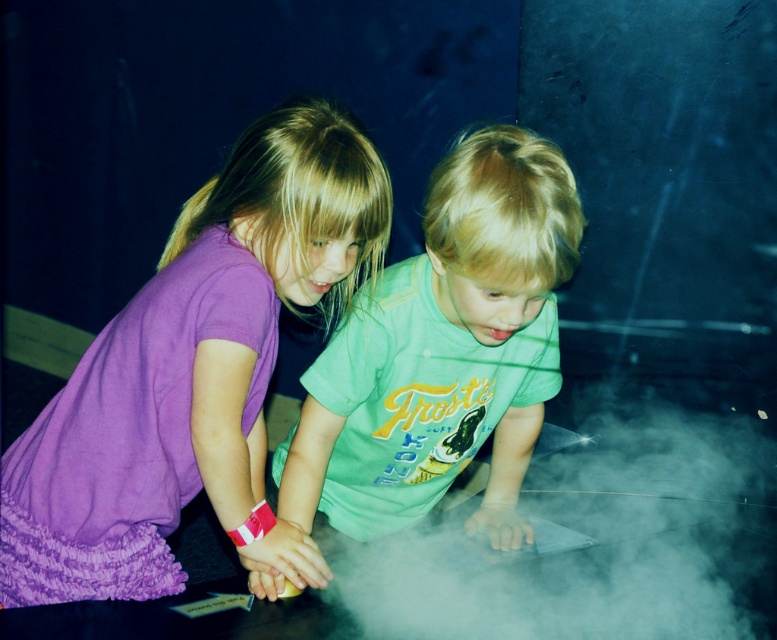
Question: Which point appears closest to the camera in this image?

Choices:
 (A) (531, 362)
 (B) (619, 608)

Answer: (B)

Question: Does purple fabric dress at left appear under green matte shirt at center?

Choices:
 (A) yes
 (B) no

Answer: (A)

Question: Which point is closer to the camera taking this photo?

Choices:
 (A) (420, 404)
 (B) (152, 500)
 (C) (610, 481)

Answer: (B)

Question: Can you confirm if purple fabric dress at left is thinner than green matte shirt at center?

Choices:
 (A) yes
 (B) no

Answer: (B)

Question: Estimate the real-world distances between objects in this image. Which object is farther from the purple fabric dress at left?

Choices:
 (A) white fog at center
 (B) green matte shirt at center

Answer: (A)

Question: Observing the image, what is the correct spatial positioning of green matte shirt at center in reference to white fog at center?

Choices:
 (A) below
 (B) above

Answer: (B)